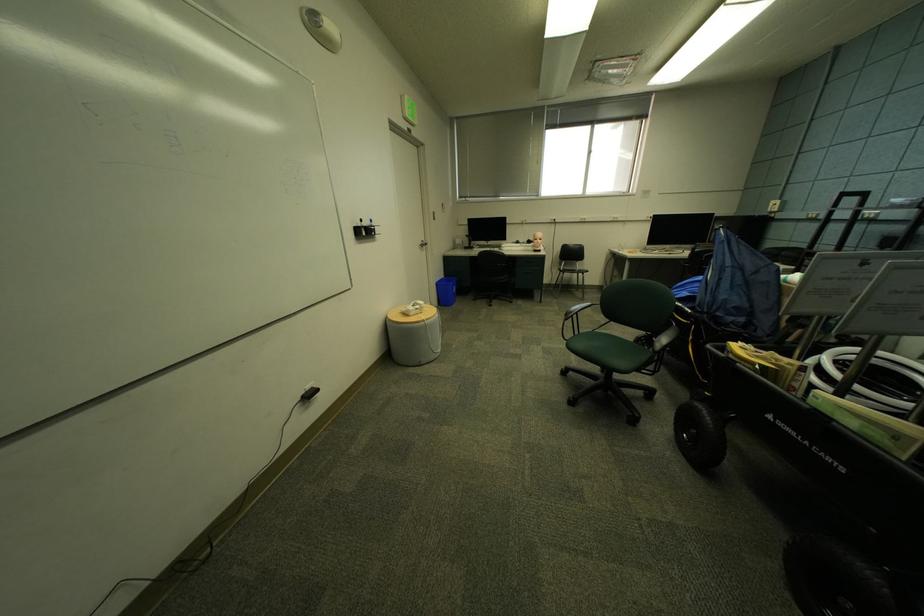
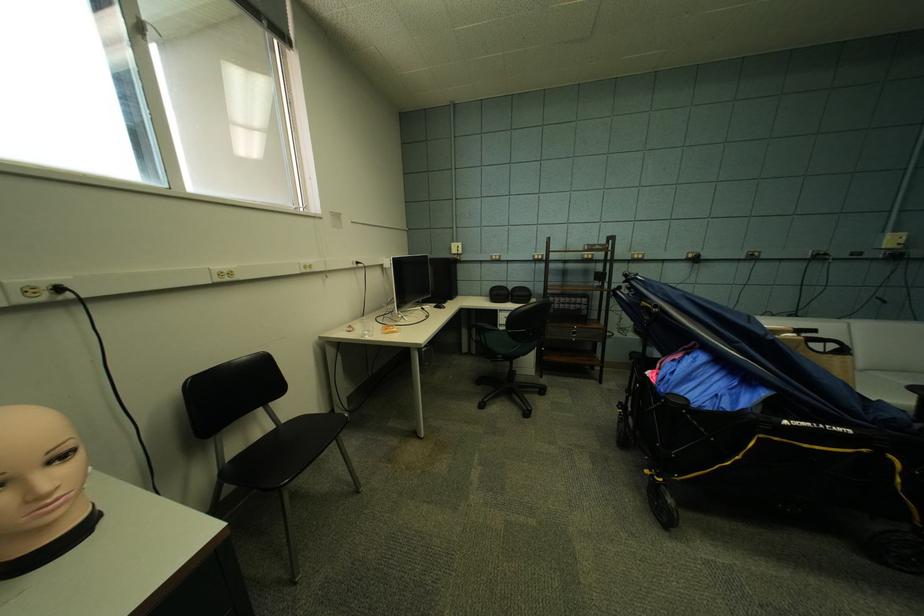
Find the pixel in the second image that matches pixel 550 241 in the first image.

(70, 459)